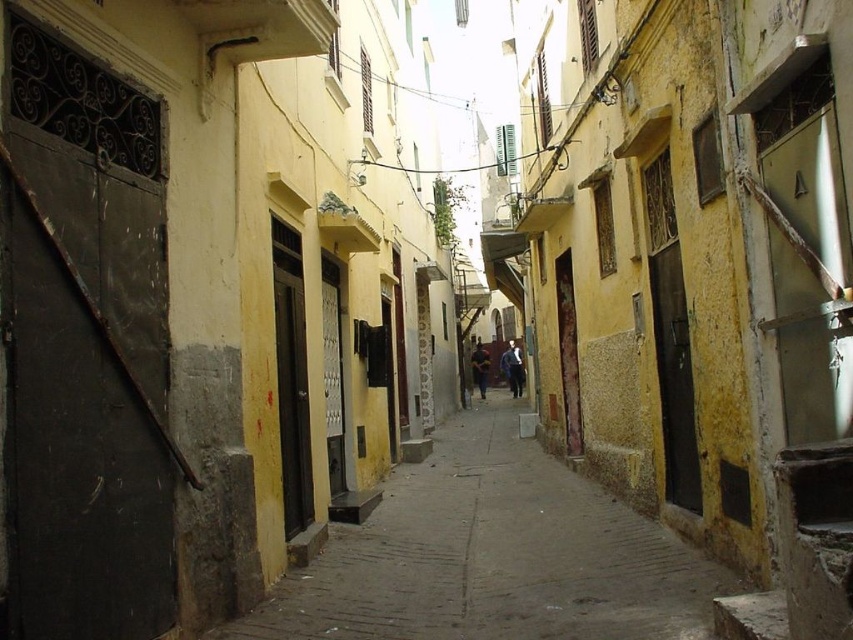
Question: Among these points, which one is nearest to the camera?

Choices:
 (A) (486, 625)
 (B) (503, 358)
 (C) (480, 378)

Answer: (A)

Question: Which object is the closest to the yellow fabric jacket at center?

Choices:
 (A) blue denim jacket at center
 (B) smooth concrete pavement at center

Answer: (A)

Question: Is smooth concrete pavement at center wider than yellow fabric jacket at center?

Choices:
 (A) yes
 (B) no

Answer: (A)

Question: Among these objects, which one is nearest to the camera?

Choices:
 (A) smooth concrete pavement at center
 (B) yellow fabric jacket at center
 (C) blue denim jacket at center

Answer: (A)

Question: Is smooth concrete pavement at center below yellow fabric jacket at center?

Choices:
 (A) yes
 (B) no

Answer: (A)

Question: Is smooth concrete pavement at center smaller than yellow fabric jacket at center?

Choices:
 (A) no
 (B) yes

Answer: (A)